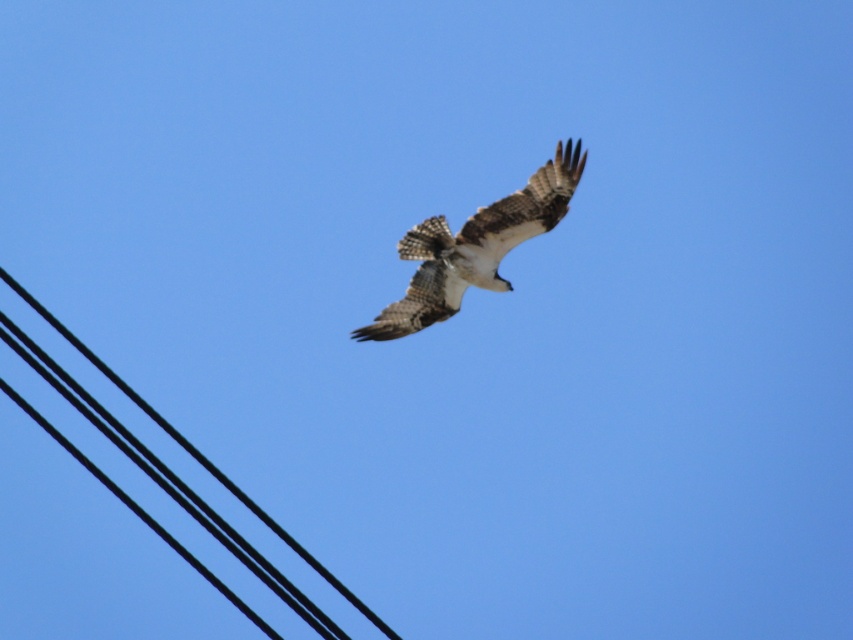
Does brown/white speckled eagle at center appear on the right side of black wire at upper left?

Indeed, brown/white speckled eagle at center is positioned on the right side of black wire at upper left.

Measure the distance between brown/white speckled eagle at center and black wire at upper left.

A distance of 12.18 meters exists between brown/white speckled eagle at center and black wire at upper left.

What do you see at coordinates (474, 248) in the screenshot? The image size is (853, 640). I see `brown/white speckled eagle at center` at bounding box center [474, 248].

The image size is (853, 640). Find the location of `brown/white speckled eagle at center`. brown/white speckled eagle at center is located at coordinates (474, 248).